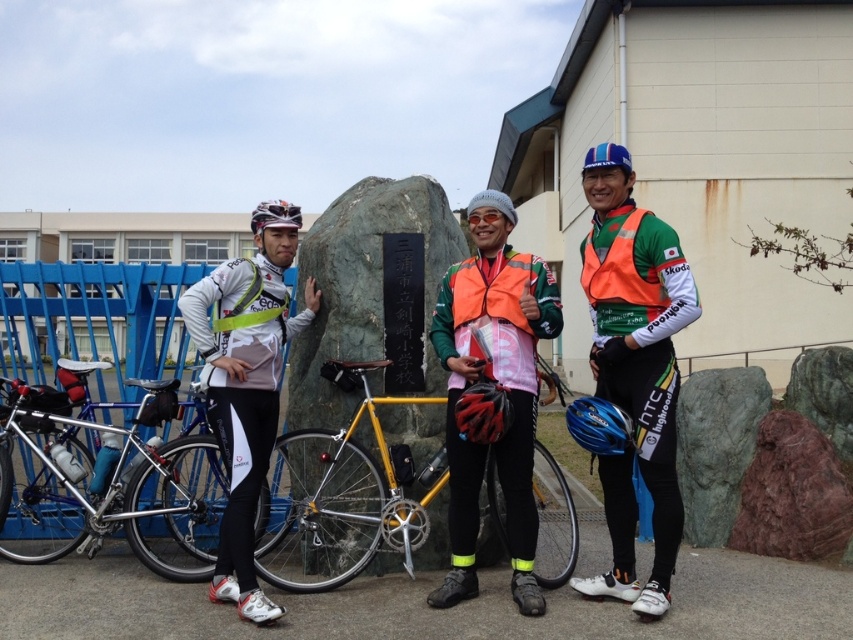
Between yellow metallic bicycle at center and black matte bicycle helmet at center, which one is positioned higher?

black matte bicycle helmet at center is above.

Which is behind, point (566, 496) or point (471, 394)?

Point (566, 496)

You are a GUI agent. You are given a task and a screenshot of the screen. Output one action in this format:
    pyautogui.click(x=<x>, y=<y>)
    Task: Click on the yellow metallic bicycle at center
    The image size is (853, 640).
    Given the screenshot: What is the action you would take?
    pyautogui.click(x=343, y=497)

Can you confirm if green polished stone at center is smaller than green marble rock at center?

Incorrect, green polished stone at center is not smaller in size than green marble rock at center.

Does green polished stone at center have a greater height compared to green marble rock at center?

Yes.

Is point (399, 429) more distant than point (798, 385)?

No.

You are a GUI agent. You are given a task and a screenshot of the screen. Output one action in this format:
    pyautogui.click(x=<x>, y=<y>)
    Task: Click on the green polished stone at center
    The width and height of the screenshot is (853, 640).
    Given the screenshot: What is the action you would take?
    pyautogui.click(x=372, y=292)

Between green rough stone at center and matte black helmet at center, which one appears on the left side from the viewer's perspective?

matte black helmet at center

Is green rough stone at center wider than matte black helmet at center?

Incorrect, green rough stone at center's width does not surpass matte black helmet at center's.

Between point (724, 433) and point (293, 204), which one is positioned behind?

Point (293, 204)

Locate an element on the screen. The height and width of the screenshot is (640, 853). green rough stone at center is located at coordinates (717, 445).